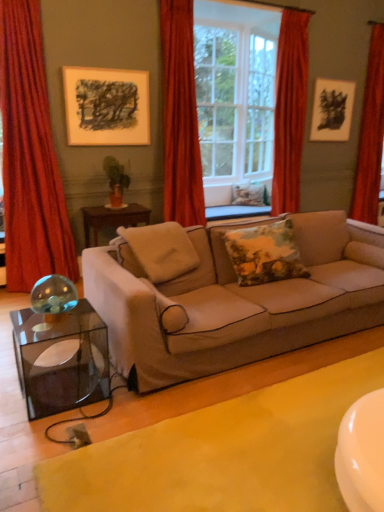
Question: Is red velvet curtain at upper center, the 2th curtain viewed from the right, positioned with its back to beige fabric couch at center?

Choices:
 (A) yes
 (B) no

Answer: (B)

Question: Can you confirm if red velvet curtain at upper center, the third curtain viewed from the left, is shorter than beige fabric couch at center?

Choices:
 (A) no
 (B) yes

Answer: (A)

Question: Is red velvet curtain at upper center, the third curtain viewed from the left, outside beige fabric couch at center?

Choices:
 (A) no
 (B) yes

Answer: (B)

Question: From a real-world perspective, is red velvet curtain at upper center, the third curtain viewed from the left, positioned over beige fabric couch at center based on gravity?

Choices:
 (A) yes
 (B) no

Answer: (A)

Question: From the image's perspective, is red velvet curtain at upper center, the third curtain viewed from the left, beneath beige fabric couch at center?

Choices:
 (A) no
 (B) yes

Answer: (A)

Question: From their relative heights in the image, would you say clear glass window at center is taller or shorter than velvet red curtain at center, positioned as the third curtain in right-to-left order?

Choices:
 (A) tall
 (B) short

Answer: (B)

Question: Is point (279, 105) positioned closer to the camera than point (190, 204)?

Choices:
 (A) farther
 (B) closer

Answer: (A)

Question: In the image, is clear glass window at center positioned in front of or behind velvet red curtain at center, the 2th curtain viewed from the left?

Choices:
 (A) front
 (B) behind

Answer: (B)

Question: Is clear glass window at center inside the boundaries of velvet red curtain at center, the 2th curtain viewed from the left, or outside?

Choices:
 (A) outside
 (B) inside

Answer: (A)

Question: Does point (332, 83) appear closer or farther from the camera than point (256, 140)?

Choices:
 (A) farther
 (B) closer

Answer: (B)

Question: Would you say black paper picture frame at upper right, positioned as the 1th picture frame in right-to-left order, is inside or outside white glass window frame at center?

Choices:
 (A) outside
 (B) inside

Answer: (A)

Question: Is black paper picture frame at upper right, positioned as the 1th picture frame in right-to-left order, bigger or smaller than white glass window frame at center?

Choices:
 (A) small
 (B) big

Answer: (A)

Question: From the image's perspective, is black paper picture frame at upper right, positioned as the 1th picture frame in right-to-left order, above or below white glass window frame at center?

Choices:
 (A) above
 (B) below

Answer: (B)

Question: Considering their positions, is white glass window frame at center located in front of or behind yellow fabric at lower center?

Choices:
 (A) front
 (B) behind

Answer: (B)

Question: From the image's perspective, relative to yellow fabric at lower center, is white glass window frame at center above or below?

Choices:
 (A) above
 (B) below

Answer: (A)